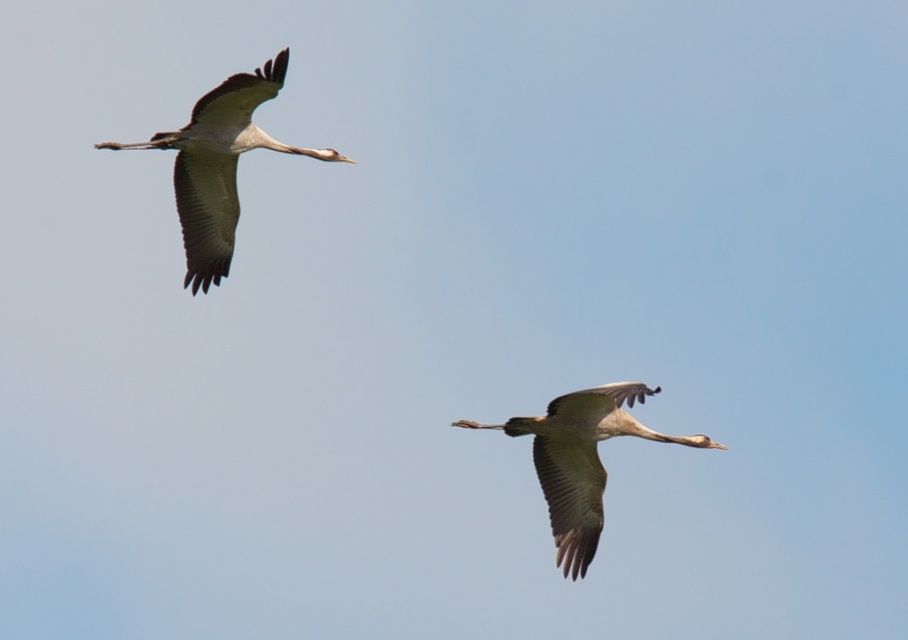
Can you confirm if gray matte bird at upper left is positioned to the right of gray feathered crane at center?

Incorrect, gray matte bird at upper left is not on the right side of gray feathered crane at center.

Which is below, gray matte bird at upper left or gray feathered crane at center?

gray feathered crane at center is below.

I want to click on gray matte bird at upper left, so [x=218, y=164].